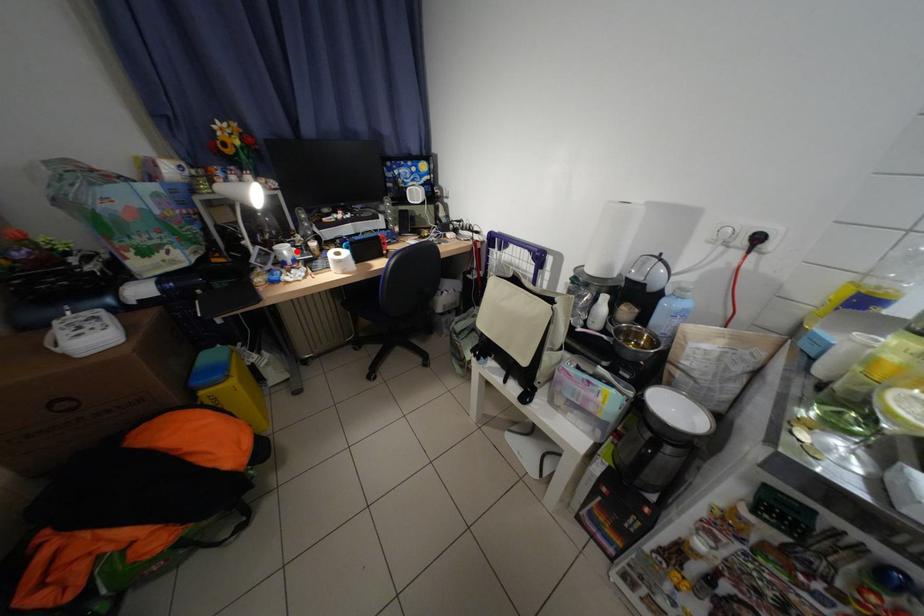
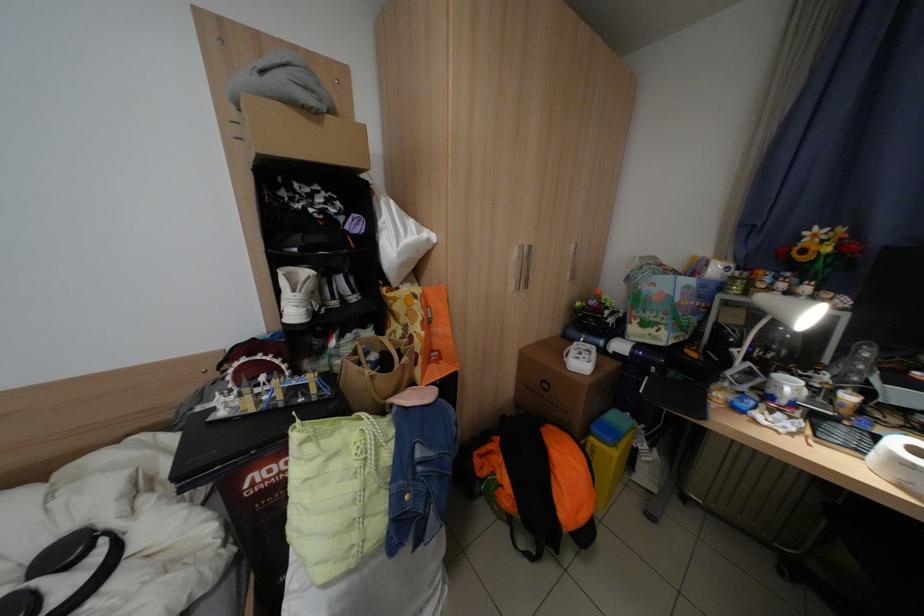
In the second image, find the point that corresponds to the highlighted location in the first image.

(800, 387)